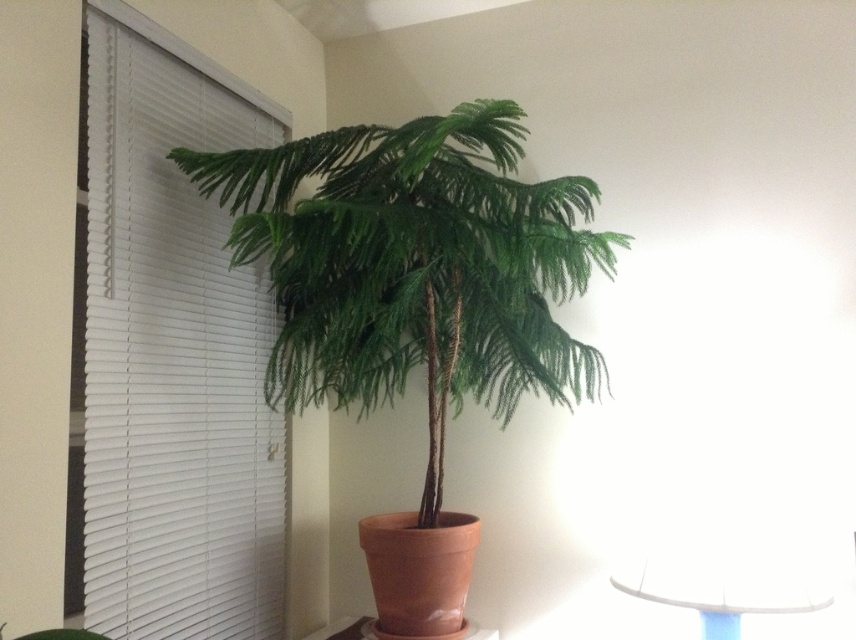
Is white blinds at left positioned at the back of white glossy table at lower right?

No.

Is point (229, 125) positioned before point (794, 557)?

No, (229, 125) is further to viewer.

Find the location of a particular element. The image size is (856, 640). white blinds at left is located at coordinates (174, 356).

The height and width of the screenshot is (640, 856). What are the coordinates of `white blinds at left` in the screenshot? It's located at (174, 356).

Does white blinds at left appear over green matte/painted palm tree at center?

No.

Is point (94, 243) farther from viewer compared to point (419, 285)?

No.

Which is behind, point (99, 483) or point (444, 358)?

Point (444, 358)

You are a GUI agent. You are given a task and a screenshot of the screen. Output one action in this format:
    pyautogui.click(x=<x>, y=<y>)
    Task: Click on the white blinds at left
    This screenshot has width=856, height=640.
    Given the screenshot: What is the action you would take?
    pyautogui.click(x=174, y=356)

Is point (591, 196) closer to camera compared to point (758, 600)?

No.

Between green matte/painted palm tree at center and white glossy table at lower right, which one is positioned higher?

Positioned higher is green matte/painted palm tree at center.

Is point (435, 205) closer to viewer compared to point (669, 602)?

No, (435, 205) is behind (669, 602).

Locate an element on the screen. The image size is (856, 640). green matte/painted palm tree at center is located at coordinates (415, 266).